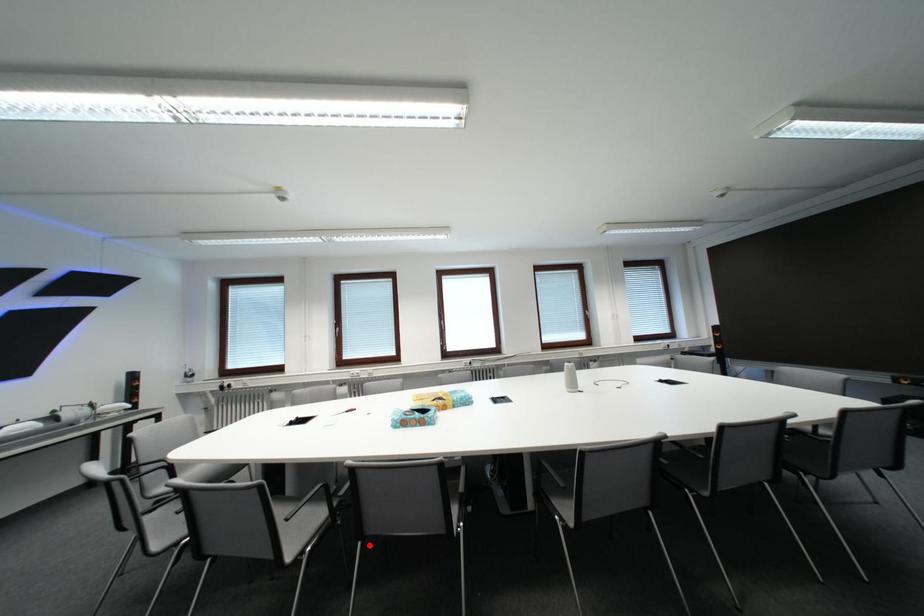
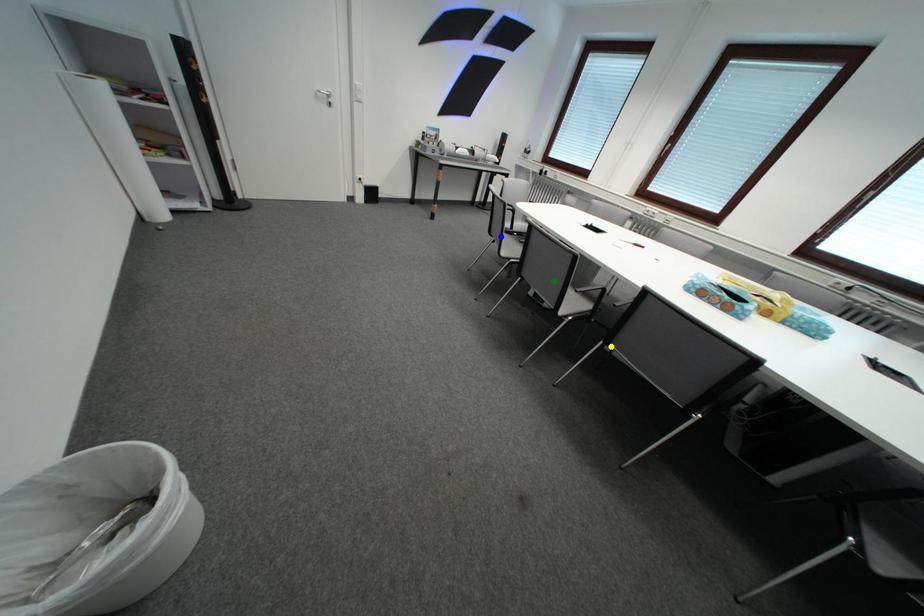
Question: I am providing you with two images of the same scene from different viewpoints. A red point is marked on the first image. You are given multiple points on the second image. Which mark in image 2 goes with the point in image 1?

Choices:
 (A) blue point
 (B) green point
 (C) yellow point

Answer: (C)